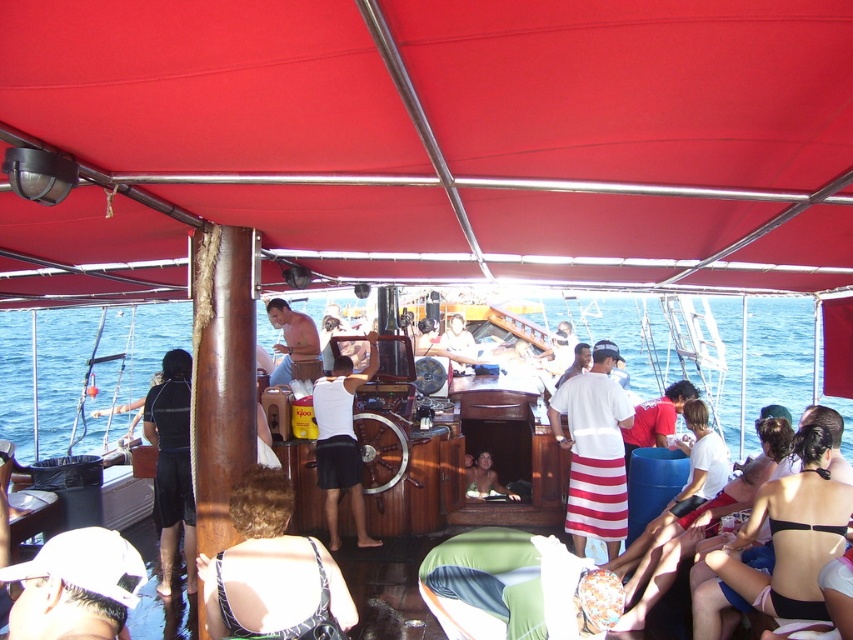
You are a photographer on the boat and want to take a photo of the smooth skin face at center under the red fabric canopy at upper center. Can you ensure the canopy will appear larger in the photo compared to the face?

The red fabric canopy at upper center is closer to the viewer than the smooth skin face at center, so yes, the canopy will appear larger in the photo compared to the face.

You are a photographer on the boat and want to capture both the patterned fabric bikini at center and the black bikini top at lower right in the same frame. Based on their positions, which one is closer to the edge of the frame?

The black bikini top at lower right is closer to the edge of the frame since it is positioned lower and to the right compared to the patterned fabric bikini at center.

You are a photographer on the boat and want to capture a photo that includes both the patterned fabric bikini at center and the black bikini top at lower right. Which one should you position to the left in your camera frame to match their actual positions?

The patterned fabric bikini at center is positioned on the left side of black bikini top at lower right, so to match their actual positions, the patterned fabric bikini at center should be to the left of the black bikini top at lower right in the photo.